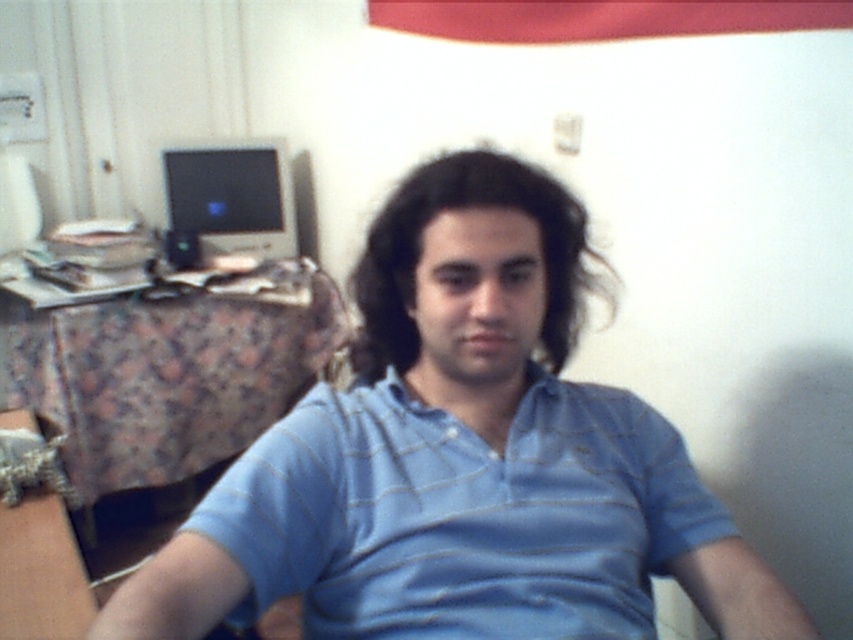
Question: Among these points, which one is farthest from the camera?

Choices:
 (A) (485, 186)
 (B) (311, 584)
 (C) (215, 176)
 (D) (553, 248)

Answer: (C)

Question: Which point appears closest to the camera in this image?

Choices:
 (A) (582, 448)
 (B) (447, 192)
 (C) (231, 216)

Answer: (B)

Question: Which of the following is the farthest from the observer?

Choices:
 (A) (409, 256)
 (B) (236, 147)
 (C) (384, 212)

Answer: (B)

Question: Does blue striped shirt at center have a smaller size compared to dark brown wavy hair at center?

Choices:
 (A) no
 (B) yes

Answer: (A)

Question: Can you confirm if blue striped shirt at center is positioned to the right of dark brown wavy hair at center?

Choices:
 (A) yes
 (B) no

Answer: (A)

Question: Does blue striped shirt at center have a lesser width compared to dark brown wavy hair at center?

Choices:
 (A) yes
 (B) no

Answer: (B)